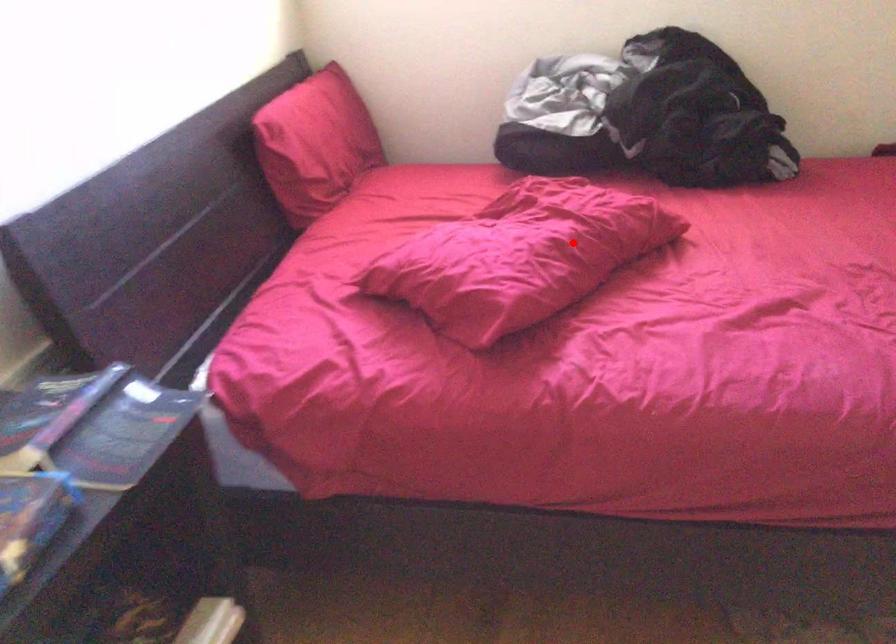
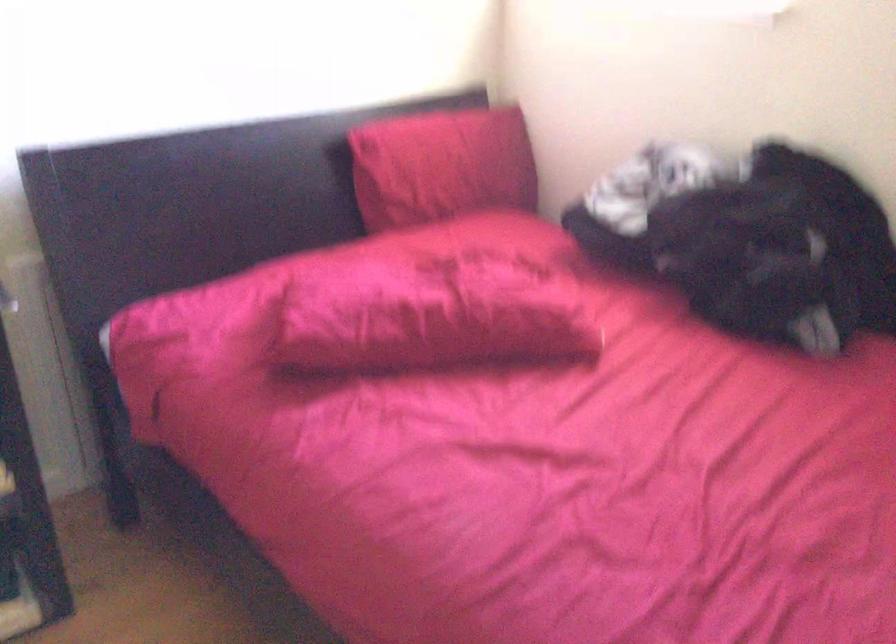
Locate, in the second image, the point that corresponds to the highlighted location in the first image.

(431, 316)